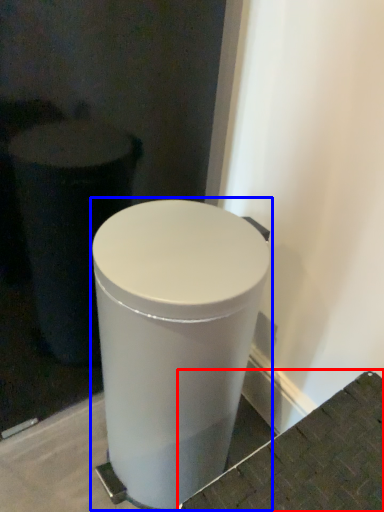
Question: Which object appears farthest to the camera in this image, concrete (highlighted by a red box) or waste container (highlighted by a blue box)?

Choices:
 (A) concrete
 (B) waste container

Answer: (B)